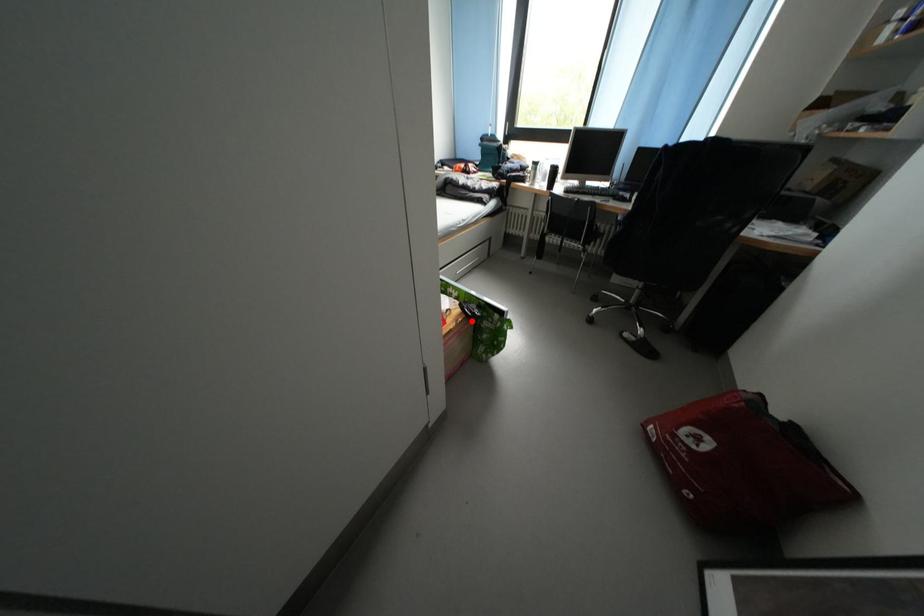
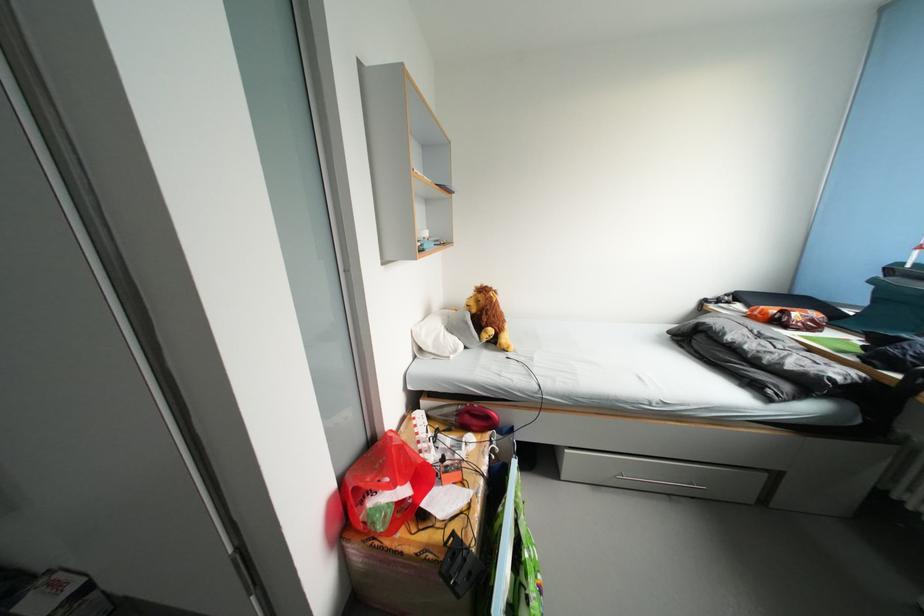
Find the pixel in the second image that matches the highlighted location in the first image.

(450, 562)